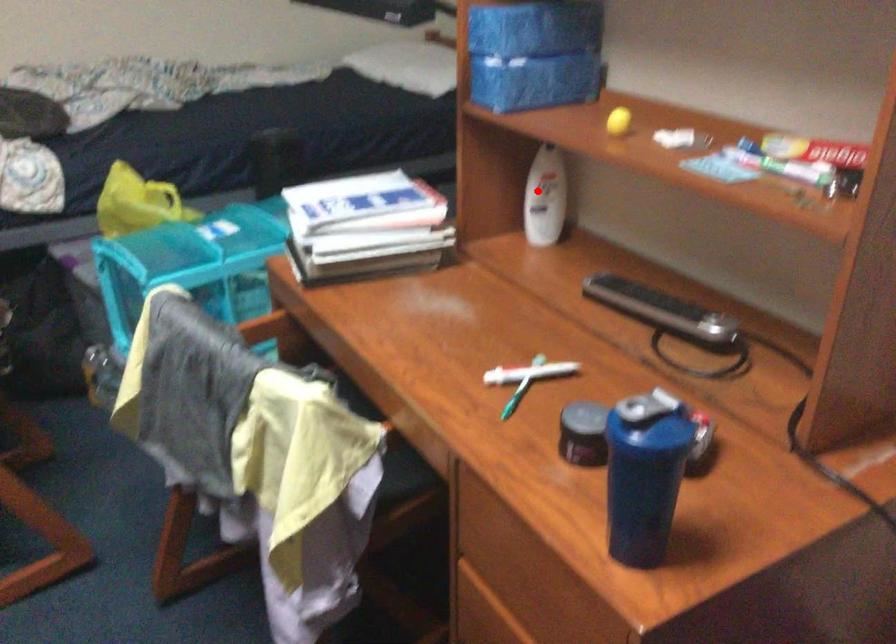
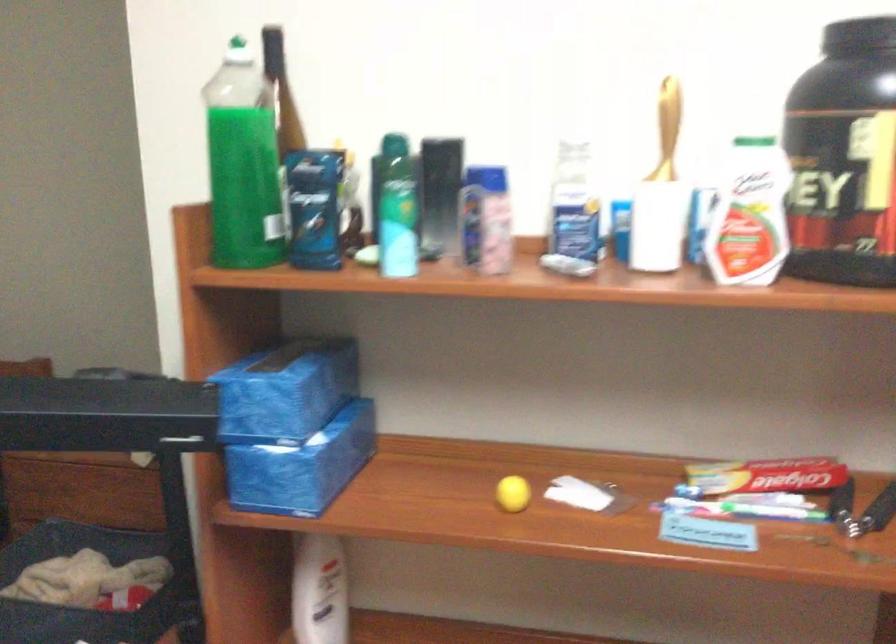
Find the pixel in the second image that matches the highlighted location in the first image.

(319, 591)